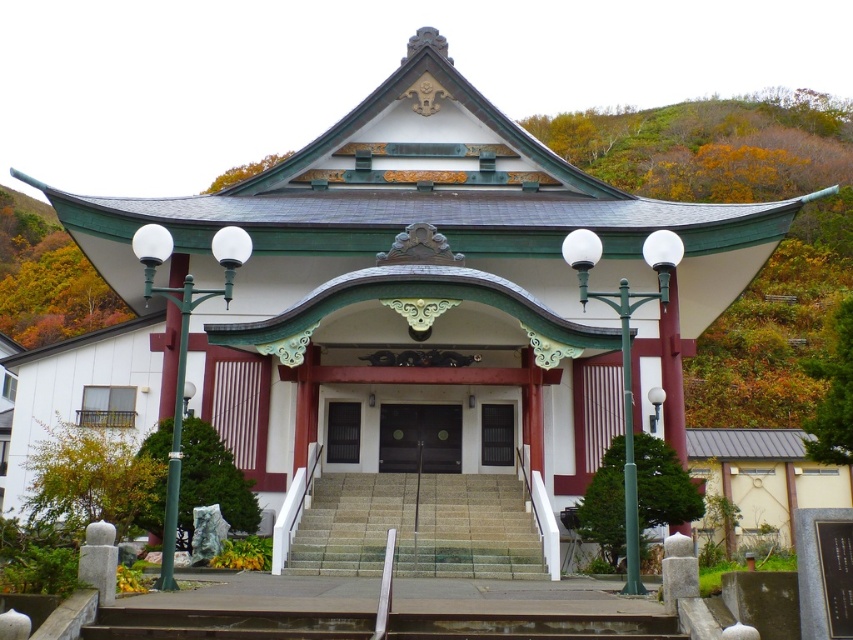
Between smooth concrete stairs at center and black glossy door at center, which one has more height?

black glossy door at center

How distant is smooth concrete stairs at center from black glossy door at center?

smooth concrete stairs at center is 12.63 feet away from black glossy door at center.

Is point (512, 483) in front of point (428, 449)?

Yes, it is.

Locate an element on the screen. smooth concrete stairs at center is located at coordinates 418,525.

Based on the photo, between smooth concrete stairs at center and matte glass door at center, which one appears on the right side from the viewer's perspective?

Positioned to the right is smooth concrete stairs at center.

Is point (509, 573) less distant than point (346, 404)?

Yes, it is.

Does point (432, 538) come closer to viewer compared to point (358, 435)?

Yes, point (432, 538) is closer to viewer.

Where is `smooth concrete stairs at center`? smooth concrete stairs at center is located at coordinates (418, 525).

Is matte black door at center positioned in front of matte glass door at center?

No, matte black door at center is further to the viewer.

Is point (496, 404) positioned after point (335, 410)?

No, it is not.

Where is `matte black door at center`? This screenshot has height=640, width=853. matte black door at center is located at coordinates (497, 435).